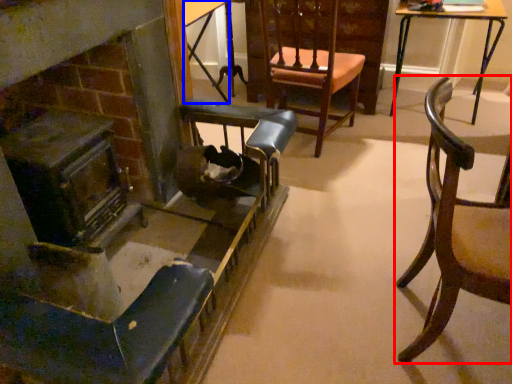
Question: Which object is further to the camera taking this photo, chair (highlighted by a red box) or table (highlighted by a blue box)?

Choices:
 (A) chair
 (B) table

Answer: (B)